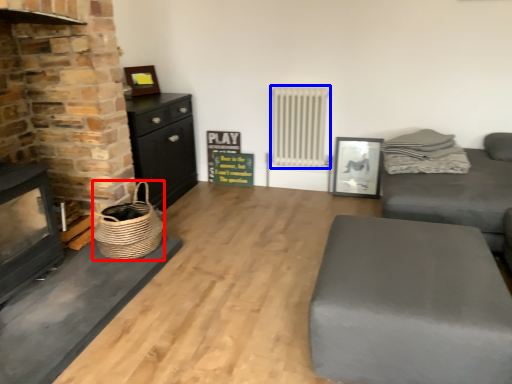
Question: Which of the following is the farthest to the observer, basket (highlighted by a red box) or radiator (highlighted by a blue box)?

Choices:
 (A) basket
 (B) radiator

Answer: (B)